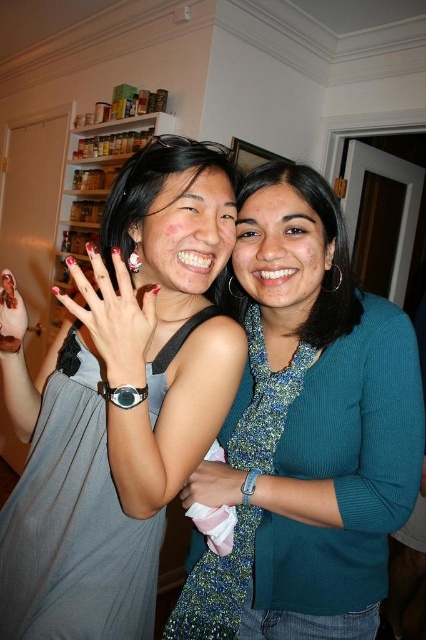
You are standing in a kitchen and want to reach a point that is exactly at coordinate (x=270, y=278). The maximum distance you can reach is 35 inches. Can you reach that point?

The point at coordinate (x=270, y=278) is 34.89 inches from the camera, which is within your maximum reach distance of 35 inches. Yes, you can reach it.

What are the coordinates of the matte black face at center?

The coordinates of the matte black face at center are point [187,230].

You are standing in a kitchen where two people are socializing. The person on the left is wearing a sleeveless gray dress with red nails, and the one on the right is in a teal cardigan. A shelving unit with jars is behind them. There is a specific point marked at coordinates (118, 401). What object is located exactly at this point?

The gray matte dress at center is located exactly at point (118, 401).